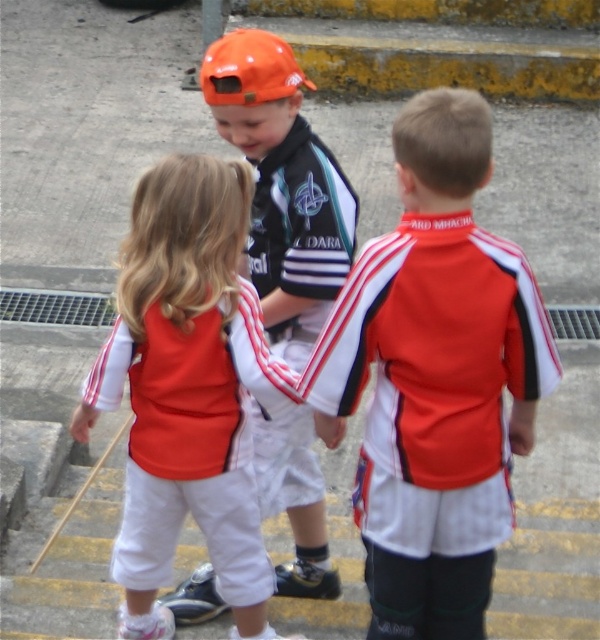
Does matte red jersey at center appear on the left side of matte red tracksuit at center?

Incorrect, matte red jersey at center is not on the left side of matte red tracksuit at center.

Which is more to the left, matte red jersey at center or matte red tracksuit at center?

From the viewer's perspective, matte red tracksuit at center appears more on the left side.

The width and height of the screenshot is (600, 640). Describe the element at coordinates (435, 378) in the screenshot. I see `matte red jersey at center` at that location.

This screenshot has height=640, width=600. In order to click on matte red jersey at center in this screenshot , I will do `click(435, 378)`.

From the picture: Which of these two, matte black jersey at center or orange matte baseball cap at center, stands taller?

With more height is matte black jersey at center.

From the picture: Does matte black jersey at center have a lesser height compared to orange matte baseball cap at center?

Incorrect, matte black jersey at center's height does not fall short of orange matte baseball cap at center's.

The width and height of the screenshot is (600, 640). What do you see at coordinates (283, 186) in the screenshot?
I see `matte black jersey at center` at bounding box center [283, 186].

Locate an element on the screen. This screenshot has width=600, height=640. matte black jersey at center is located at coordinates point(283,186).

Between matte red tracksuit at center and matte black jersey at center, which one has less height?

Standing shorter between the two is matte red tracksuit at center.

Does matte red tracksuit at center appear on the left side of matte black jersey at center?

Correct, you'll find matte red tracksuit at center to the left of matte black jersey at center.

Who is more distant from viewer, (238,328) or (219,97)?

The point (219,97) is behind.

At what (x,y) coordinates should I click in order to perform the action: click on matte red tracksuit at center. Please return your answer as a coordinate pair (x, y). The height and width of the screenshot is (640, 600). Looking at the image, I should click on [x=187, y=392].